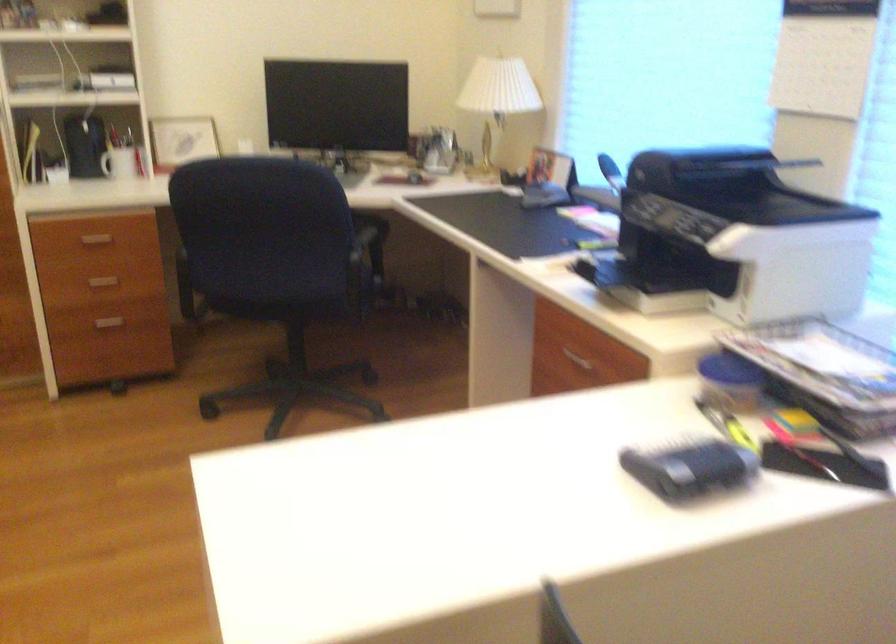
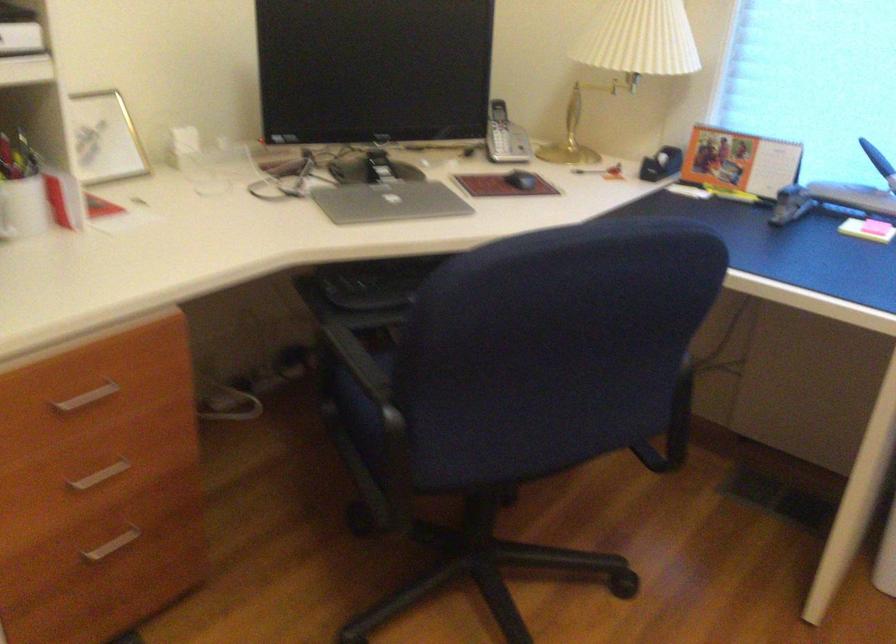
Locate, in the second image, the point that corresponds to the point at 192,241 in the first image.

(365, 375)